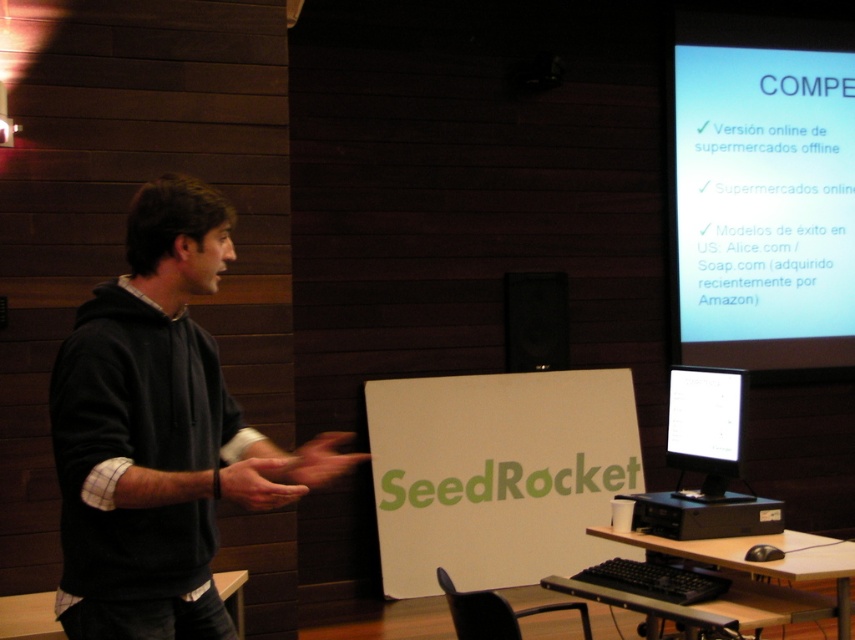
You are an attendee in the conference room and want to take a photo of the presenter and the slide. The presenter is wearing a dark gray hoodie at left. The slide is displayed on the matte black monitor at center. Since you want to capture both in the frame, which object should you place closer to the camera to ensure both are visible?

You should position yourself closer to the matte black monitor at center so that both the dark gray hoodie at left and the matte black monitor at center are within the camera frame. Since the dark gray hoodie at left is on the left side of the matte black monitor at center, adjusting your position to center the monitor will help include the presenter in the shot.

You are setting up equipment for a presentation. You need to place a 3.5 meter long cable between the white glossy projector screen at upper right and the matte black monitor at center. Is the cable long enough to reach them without moving either device?

The white glossy projector screen at upper right and matte black monitor at center are 2.54 meters apart from each other. The 3.5 meter cable is longer than the distance between them, so it should be sufficient to connect both devices without needing to move either.